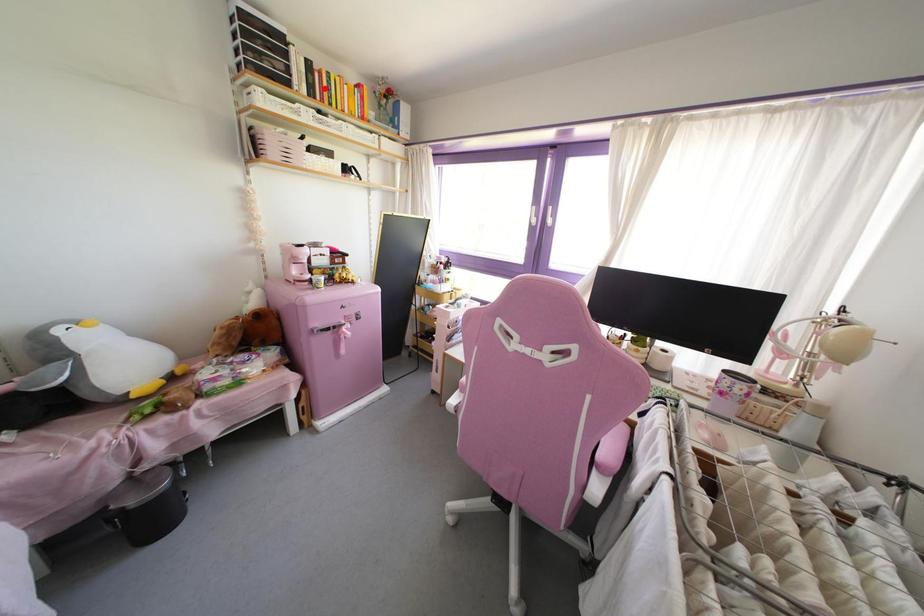
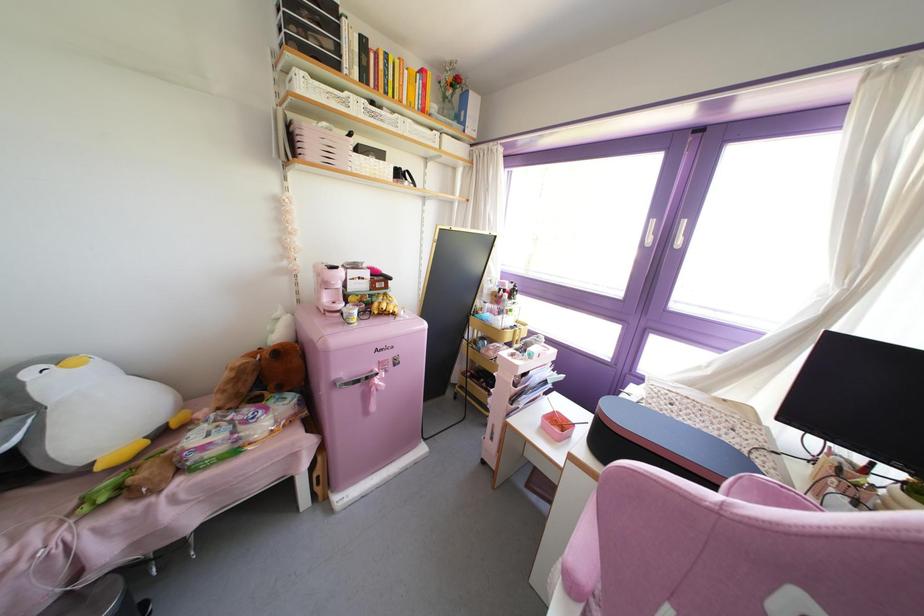
Where in the second image is the point corresponding to the highlighted location from the first image?

(381, 74)